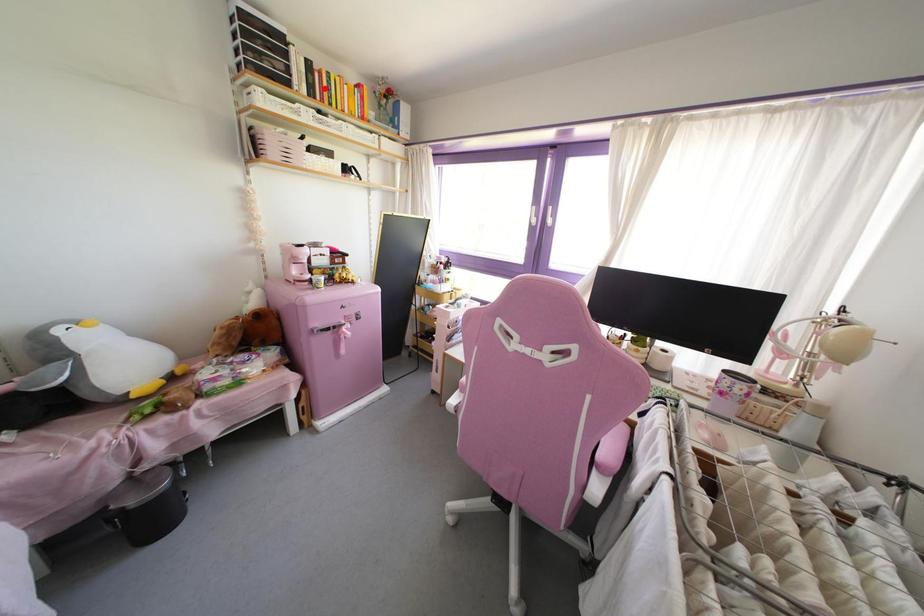
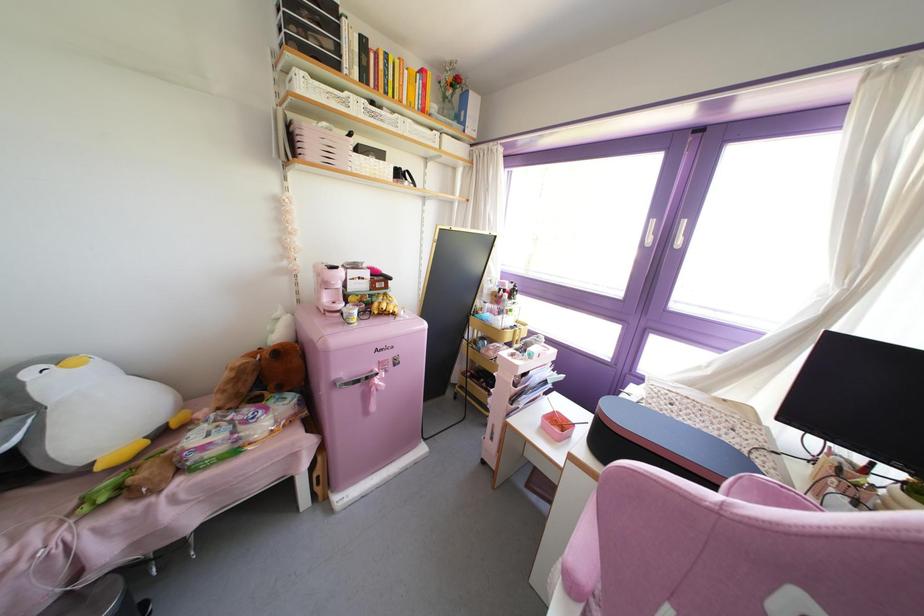
Where in the second image is the point corresponding to the highlighted location from the first image?

(381, 74)